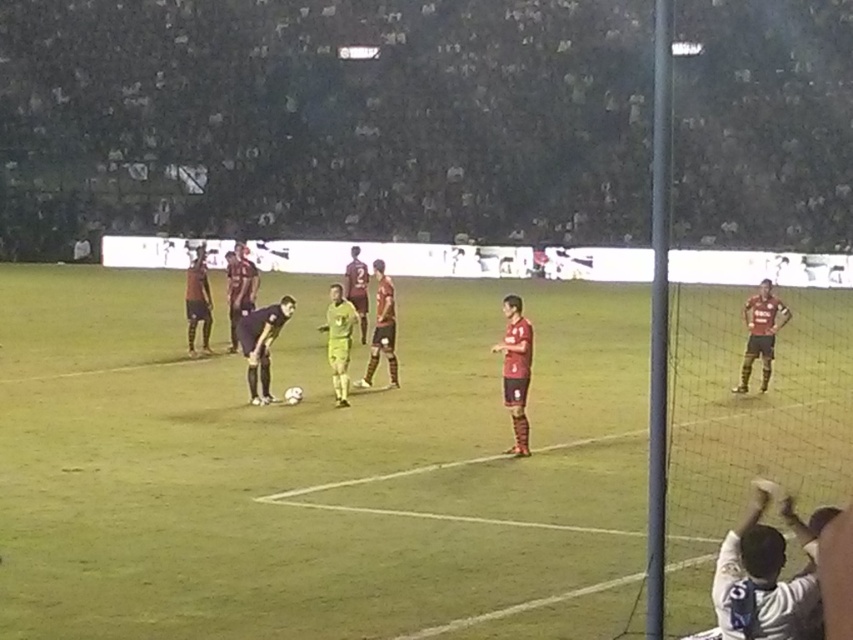
Does point (527, 385) lie in front of point (782, 307)?

Yes, point (527, 385) is in front of point (782, 307).

Between matte red jersey at center and maroon jersey at right, which one appears on the right side from the viewer's perspective?

maroon jersey at right

The height and width of the screenshot is (640, 853). What do you see at coordinates (515, 369) in the screenshot?
I see `matte red jersey at center` at bounding box center [515, 369].

Locate an element on the screen. This screenshot has height=640, width=853. matte red jersey at center is located at coordinates (515, 369).

Which is more to the right, green grass field at center or matte red jersey at center?

green grass field at center is more to the right.

Is point (83, 580) in front of point (508, 324)?

That is True.

You are a GUI agent. You are given a task and a screenshot of the screen. Output one action in this format:
    pyautogui.click(x=<x>, y=<y>)
    Task: Click on the green grass field at center
    The image size is (853, 640).
    Given the screenshot: What is the action you would take?
    pyautogui.click(x=317, y=468)

Is the position of green grass field at center less distant than that of yellow-green jersey at center?

Yes, it is.

Who is shorter, green grass field at center or yellow-green jersey at center?

yellow-green jersey at center is shorter.

Locate an element on the screen. green grass field at center is located at coordinates (317, 468).